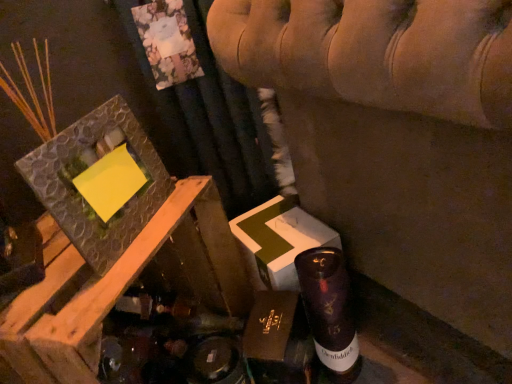
Question: Can you confirm if shiny purple glass bottle at lower right is wider than velvet beige sofa at upper center?

Choices:
 (A) no
 (B) yes

Answer: (A)

Question: From the image's perspective, does shiny purple glass bottle at lower right appear higher than velvet beige sofa at upper center?

Choices:
 (A) yes
 (B) no

Answer: (B)

Question: Does shiny purple glass bottle at lower right appear on the left side of velvet beige sofa at upper center?

Choices:
 (A) no
 (B) yes

Answer: (B)

Question: Considering the relative sizes of shiny purple glass bottle at lower right and velvet beige sofa at upper center in the image provided, is shiny purple glass bottle at lower right shorter than velvet beige sofa at upper center?

Choices:
 (A) no
 (B) yes

Answer: (B)

Question: From a real-world perspective, is shiny purple glass bottle at lower right on top of velvet beige sofa at upper center?

Choices:
 (A) no
 (B) yes

Answer: (A)

Question: From the image's perspective, is textured stone picture frame at upper left positioned above or below brown cardboard box at center?

Choices:
 (A) above
 (B) below

Answer: (A)

Question: Considering the positions of textured stone picture frame at upper left and brown cardboard box at center in the image, is textured stone picture frame at upper left bigger or smaller than brown cardboard box at center?

Choices:
 (A) big
 (B) small

Answer: (B)

Question: In terms of width, does textured stone picture frame at upper left look wider or thinner when compared to brown cardboard box at center?

Choices:
 (A) wide
 (B) thin

Answer: (B)

Question: Considering the positions of point (112, 112) and point (276, 324), is point (112, 112) closer or farther from the camera than point (276, 324)?

Choices:
 (A) farther
 (B) closer

Answer: (B)

Question: Is point (335, 269) positioned closer to the camera than point (77, 228)?

Choices:
 (A) closer
 (B) farther

Answer: (B)

Question: Considering the relative positions of shiny purple glass bottle at lower right and textured stone picture frame at upper left in the image provided, is shiny purple glass bottle at lower right to the left or to the right of textured stone picture frame at upper left?

Choices:
 (A) right
 (B) left

Answer: (A)

Question: Is shiny purple glass bottle at lower right situated inside textured stone picture frame at upper left or outside?

Choices:
 (A) outside
 (B) inside

Answer: (A)

Question: From a real-world perspective, is shiny purple glass bottle at lower right above or below textured stone picture frame at upper left?

Choices:
 (A) below
 (B) above

Answer: (A)

Question: In the image, is brown cardboard box at center positioned in front of or behind velvet beige sofa at upper center?

Choices:
 (A) behind
 (B) front

Answer: (A)

Question: From a real-world perspective, is brown cardboard box at center above or below velvet beige sofa at upper center?

Choices:
 (A) above
 (B) below

Answer: (B)